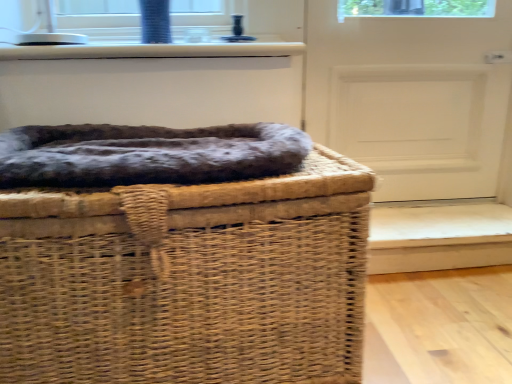
The height and width of the screenshot is (384, 512). What do you see at coordinates (188, 280) in the screenshot? I see `woven brown basket at center` at bounding box center [188, 280].

Image resolution: width=512 pixels, height=384 pixels. I want to click on dark gray plush dog bed at center, so click(147, 154).

Describe the element at coordinates (152, 50) in the screenshot. I see `white glossy window sill at upper center` at that location.

Locate an element on the screen. woven brown basket at center is located at coordinates (188, 280).

Is point (33, 47) closer to camera compared to point (68, 138)?

That is False.

Are white glossy window sill at upper center and dark gray plush dog bed at center beside each other?

white glossy window sill at upper center is not next to dark gray plush dog bed at center, and they're not touching.

Does white glossy window sill at upper center have a smaller size compared to dark gray plush dog bed at center?

Yes.

From the image's perspective, relative to dark gray plush dog bed at center, is white glossy window sill at upper center above or below?

white glossy window sill at upper center is situated higher than dark gray plush dog bed at center in the image.

From the image's perspective, which is above, woven brown basket at center or dark gray plush dog bed at center?

dark gray plush dog bed at center appears higher in the image.

Considering the sizes of objects woven brown basket at center and dark gray plush dog bed at center in the image provided, who is thinner, woven brown basket at center or dark gray plush dog bed at center?

dark gray plush dog bed at center is thinner.

Find the location of a particular element. furniture below the dark gray plush dog bed at center (from the image's perspective) is located at coordinates (188, 280).

In terms of size, does woven brown basket at center appear bigger or smaller than dark gray plush dog bed at center?

Clearly, woven brown basket at center is larger in size than dark gray plush dog bed at center.

Considering the sizes of objects white matte door at center and woven brown basket at center in the image provided, who is shorter, white matte door at center or woven brown basket at center?

woven brown basket at center is shorter.

Is white matte door at center positioned far away from woven brown basket at center?

They are positioned close to each other.

From the image's perspective, is white matte door at center beneath woven brown basket at center?

Incorrect, from the image's perspective, white matte door at center is higher than woven brown basket at center.

How many degrees apart are the facing directions of white matte door at center and dark gray plush dog bed at center?

The angular difference between white matte door at center and dark gray plush dog bed at center is 1.04 degrees.

Can you confirm if white matte door at center is bigger than dark gray plush dog bed at center?

Yes, white matte door at center is bigger than dark gray plush dog bed at center.

Is white matte door at center wider than dark gray plush dog bed at center?

No.

The image size is (512, 384). In order to click on dog bed located underneath the white matte door at center (from a real-world perspective) in this screenshot , I will do `click(147, 154)`.

Could you tell me if white glossy window sill at upper center is facing white matte door at center?

No.

Looking at their sizes, would you say white glossy window sill at upper center is wider or thinner than white matte door at center?

white glossy window sill at upper center is wider than white matte door at center.

From a real-world perspective, which object stands above the other?

white glossy window sill at upper center.

Who is shorter, white glossy window sill at upper center or white matte door at center?

With less height is white glossy window sill at upper center.

Considering the positions of objects woven brown basket at center and white glossy window sill at upper center in the image provided, who is behind, woven brown basket at center or white glossy window sill at upper center?

white glossy window sill at upper center.

Is point (241, 239) positioned in front of point (74, 46)?

That is True.

Is woven brown basket at center facing towards white glossy window sill at upper center?

No, woven brown basket at center is not aimed at white glossy window sill at upper center.

Which object is thinner, woven brown basket at center or white glossy window sill at upper center?

With smaller width is white glossy window sill at upper center.

Considering the relative sizes of dark gray plush dog bed at center and white matte door at center in the image provided, is dark gray plush dog bed at center taller than white matte door at center?

No.

Is dark gray plush dog bed at center far away from white matte door at center?

They are positioned close to each other.

Considering the positions of point (249, 151) and point (447, 116), is point (249, 151) closer or farther from the camera than point (447, 116)?

Point (249, 151) appears to be closer to the viewer than point (447, 116).

Where is `dog bed on the right side of white glossy window sill at upper center`? The width and height of the screenshot is (512, 384). dog bed on the right side of white glossy window sill at upper center is located at coordinates (147, 154).

I want to click on dog bed behind the woven brown basket at center, so click(x=147, y=154).

Which object lies further to the anchor point dark gray plush dog bed at center, white glossy window sill at upper center or white matte door at center?

white matte door at center.

From the picture: From the image, which object appears to be farther from woven brown basket at center, dark gray plush dog bed at center or white matte door at center?

white matte door at center.

Estimate the real-world distances between objects in this image. Which object is further from dark gray plush dog bed at center, woven brown basket at center or white glossy window sill at upper center?

The object further to dark gray plush dog bed at center is white glossy window sill at upper center.

Looking at the image, which one is located closer to white glossy window sill at upper center, dark gray plush dog bed at center or white matte door at center?

The object closer to white glossy window sill at upper center is dark gray plush dog bed at center.

When comparing their distances from white glossy window sill at upper center, does white matte door at center or woven brown basket at center seem closer?

white matte door at center.

Considering their positions, is white glossy window sill at upper center positioned closer to woven brown basket at center than dark gray plush dog bed at center?

The object closer to woven brown basket at center is dark gray plush dog bed at center.

From the image, which object appears to be nearer to woven brown basket at center, white matte door at center or dark gray plush dog bed at center?

dark gray plush dog bed at center is positioned closer to the anchor woven brown basket at center.

Which object lies nearer to the anchor point dark gray plush dog bed at center, white matte door at center or woven brown basket at center?

Based on the image, woven brown basket at center appears to be nearer to dark gray plush dog bed at center.

Where is `furniture located between white glossy window sill at upper center and white matte door at center in the left-right direction`? This screenshot has width=512, height=384. furniture located between white glossy window sill at upper center and white matte door at center in the left-right direction is located at coordinates (188, 280).

Locate an element on the screen. Image resolution: width=512 pixels, height=384 pixels. dog bed between white glossy window sill at upper center and woven brown basket at center in the up-down direction is located at coordinates (147, 154).

I want to click on dog bed between white glossy window sill at upper center and white matte door at center in the horizontal direction, so click(147, 154).

Find the location of a particular element. furniture between dark gray plush dog bed at center and white matte door at center in the horizontal direction is located at coordinates (188, 280).